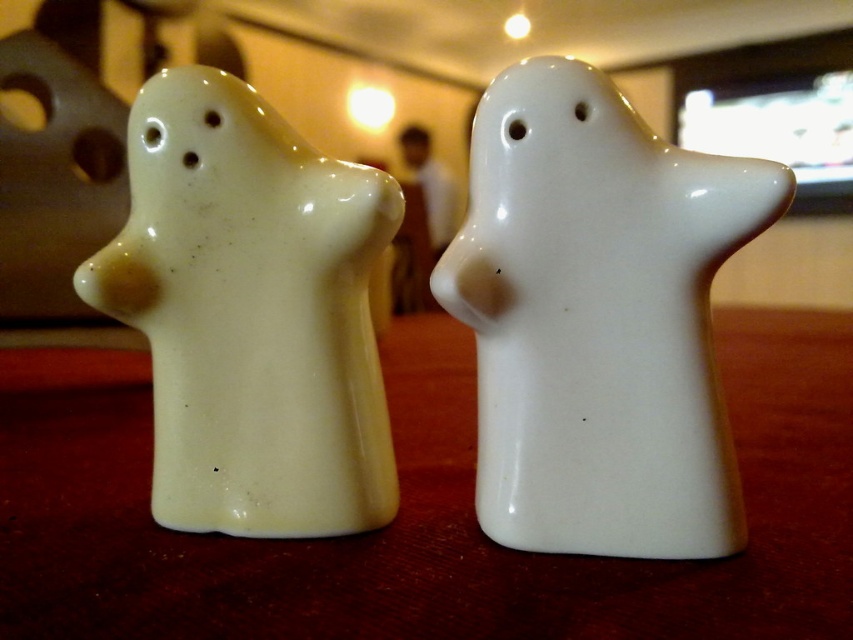
Question: Which object is farther from the camera taking this photo?

Choices:
 (A) white glossy ghost at center
 (B) matte white ghost at left

Answer: (B)

Question: Does white glossy table at center appear over matte white ghost at left?

Choices:
 (A) yes
 (B) no

Answer: (B)

Question: Which point is farther to the camera?

Choices:
 (A) (306, 349)
 (B) (627, 513)

Answer: (A)

Question: Which object appears closest to the camera in this image?

Choices:
 (A) white glossy ghost at center
 (B) matte white ghost at left

Answer: (A)

Question: Does white glossy table at center have a lesser width compared to white glossy ghost at center?

Choices:
 (A) no
 (B) yes

Answer: (A)

Question: Does white glossy table at center have a smaller size compared to white glossy ghost at center?

Choices:
 (A) no
 (B) yes

Answer: (A)